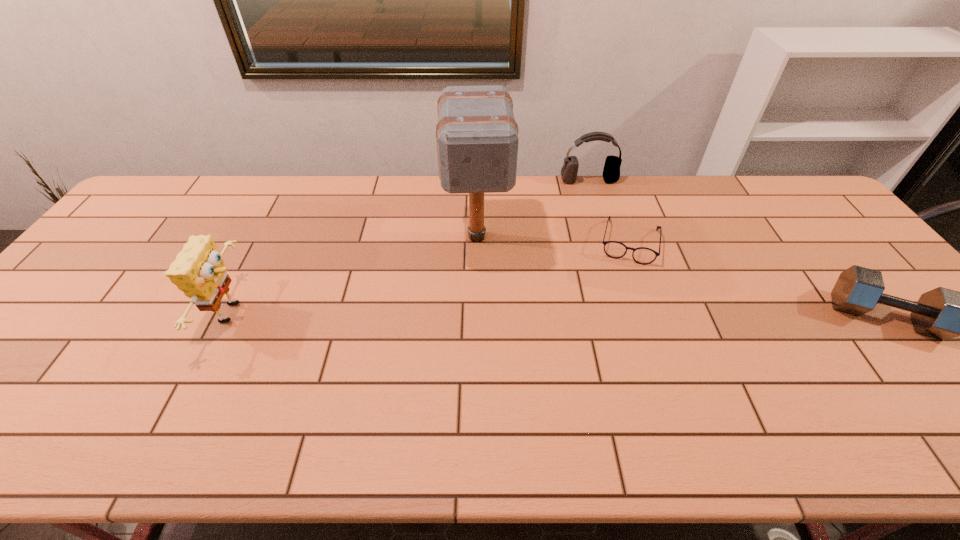
Find the location of a particular element. vacant area between the fourth object from right to left and the spectacles is located at coordinates (553, 239).

Choose which object is the nearest neighbor to the sponge. Please provide its 2D coordinates. Your answer should be formatted as a tuple, i.e. [(x, y)], where the tuple contains the x and y coordinates of a point satisfying the conditions above.

[(477, 139)]

Point out which object is positioned as the nearest to the shortest object. Please provide its 2D coordinates. Your answer should be formatted as a tuple, i.e. [(x, y)], where the tuple contains the x and y coordinates of a point satisfying the conditions above.

[(611, 173)]

This screenshot has width=960, height=540. In order to click on free spot that satisfies the following two spatial constraints: 1. on the front side of the headset; 2. on the right side of the shortest object in this screenshot , I will do `click(608, 242)`.